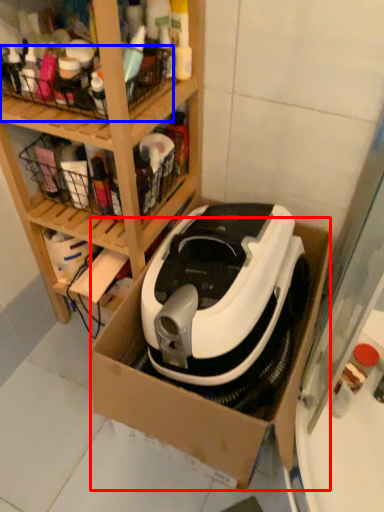
Question: Which object is closer to the camera taking this photo, cardboard box (highlighted by a red box) or basket (highlighted by a blue box)?

Choices:
 (A) cardboard box
 (B) basket

Answer: (A)